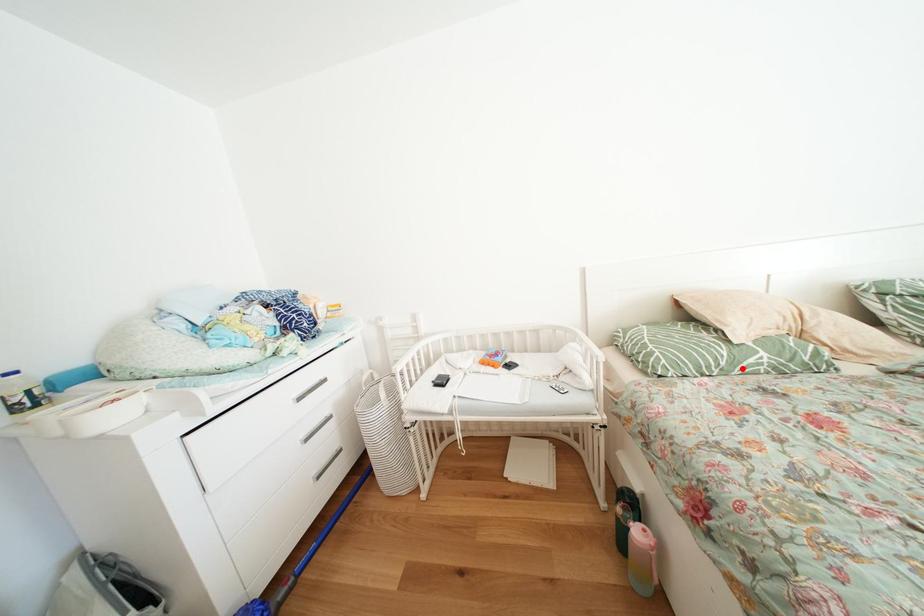
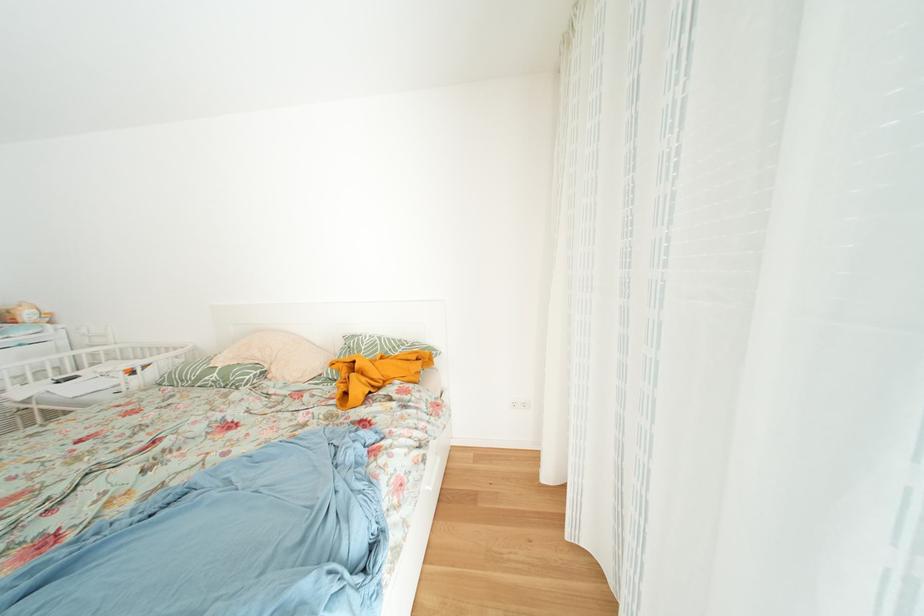
Locate, in the second image, the point that corresponds to the highlighted location in the first image.

(208, 384)